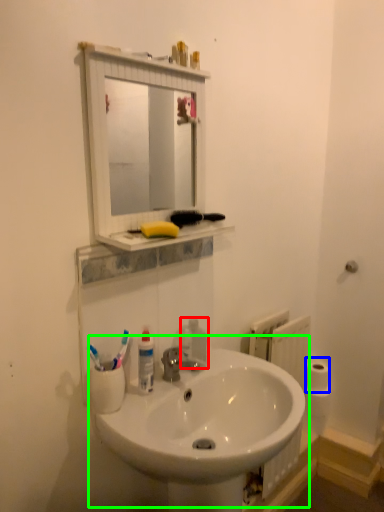
Question: Considering the real-world distances, which object is farthest from soap dispenser (highlighted by a red box)? toilet paper (highlighted by a blue box) or sink (highlighted by a green box)?

Choices:
 (A) toilet paper
 (B) sink

Answer: (A)